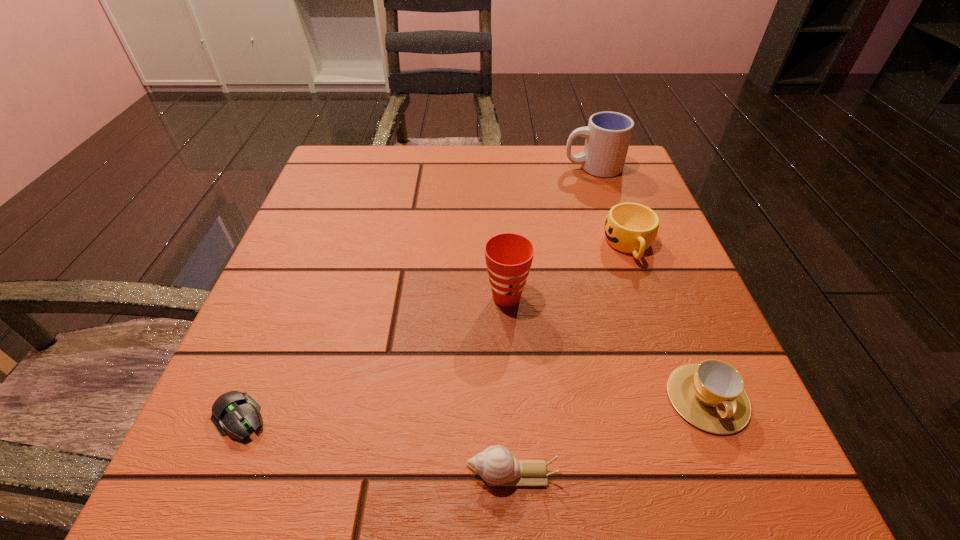
The image size is (960, 540). Find the location of `vacant space at the far right corner of the desktop`. vacant space at the far right corner of the desktop is located at coordinates (587, 181).

At what (x,y) coordinates should I click in order to perform the action: click on vacant space at the near right corner of the desktop. Please return your answer as a coordinate pair (x, y). Looking at the image, I should click on (752, 495).

Locate an element on the screen. Image resolution: width=960 pixels, height=540 pixels. unoccupied area between the farthest cup and the leftmost cup is located at coordinates (549, 232).

Image resolution: width=960 pixels, height=540 pixels. What are the coordinates of `vacant area that lies between the shortest cup and the nearest object` in the screenshot? It's located at tap(610, 436).

Where is `free spot between the farthest object and the second farthest object`? Image resolution: width=960 pixels, height=540 pixels. free spot between the farthest object and the second farthest object is located at coordinates (611, 206).

This screenshot has width=960, height=540. Identify the location of vacant space in between the leftmost object and the fifth nearest object. (435, 331).

What are the coordinates of `vacant area between the shortest cup and the farthest cup` in the screenshot? It's located at pyautogui.click(x=650, y=282).

Identify the location of vacant space in between the nearest cup and the escargot. The width and height of the screenshot is (960, 540). (610, 436).

The width and height of the screenshot is (960, 540). In order to click on vacant area that lies between the farthest object and the second nearest cup in this screenshot , I will do `click(549, 232)`.

The height and width of the screenshot is (540, 960). I want to click on unoccupied area between the fifth nearest object and the farthest cup, so click(x=611, y=206).